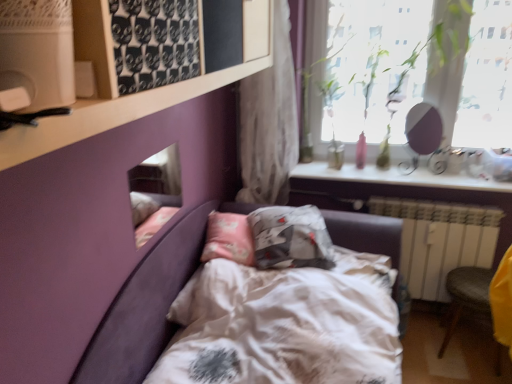
At what (x,y) coordinates should I click in order to perform the action: click on free space on the front side of matte purple mirror at upper right, which ranks as the second mirror in front-to-back order. Please return your answer as a coordinate pair (x, y). Looking at the image, I should click on (431, 178).